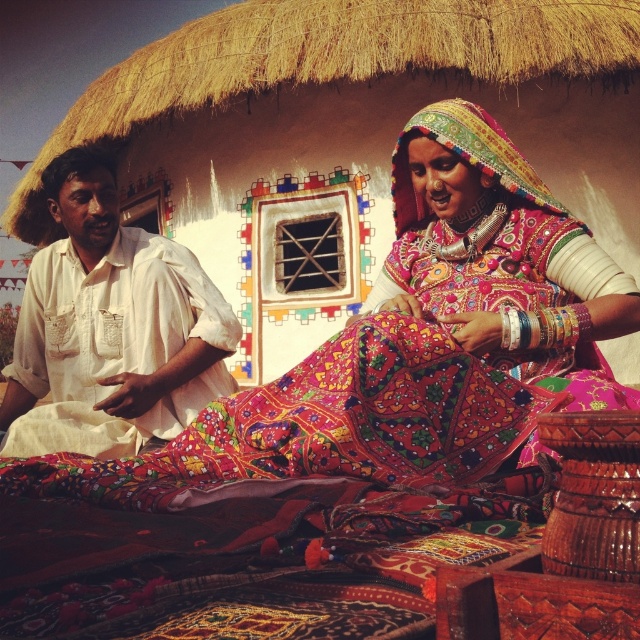
Question: Which point is farther to the camera?

Choices:
 (A) (426, 364)
 (B) (161, 416)

Answer: (B)

Question: Is embroidered fabric dress at center below white cotton shirt at left?

Choices:
 (A) no
 (B) yes

Answer: (A)

Question: Among these objects, which one is nearest to the camera?

Choices:
 (A) white cotton shirt at left
 (B) embroidered fabric dress at center

Answer: (B)

Question: Is embroidered fabric dress at center smaller than white cotton shirt at left?

Choices:
 (A) no
 (B) yes

Answer: (A)

Question: Is embroidered fabric dress at center below white cotton shirt at left?

Choices:
 (A) no
 (B) yes

Answer: (A)